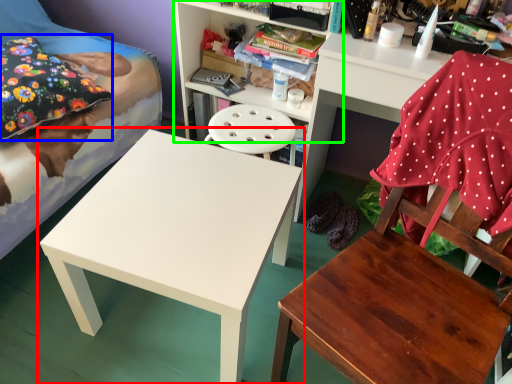
Question: Estimate the real-world distances between objects in this image. Which object is closer to table (highlighted by a red box), pillow (highlighted by a blue box) or shelf (highlighted by a green box)?

Choices:
 (A) pillow
 (B) shelf

Answer: (A)